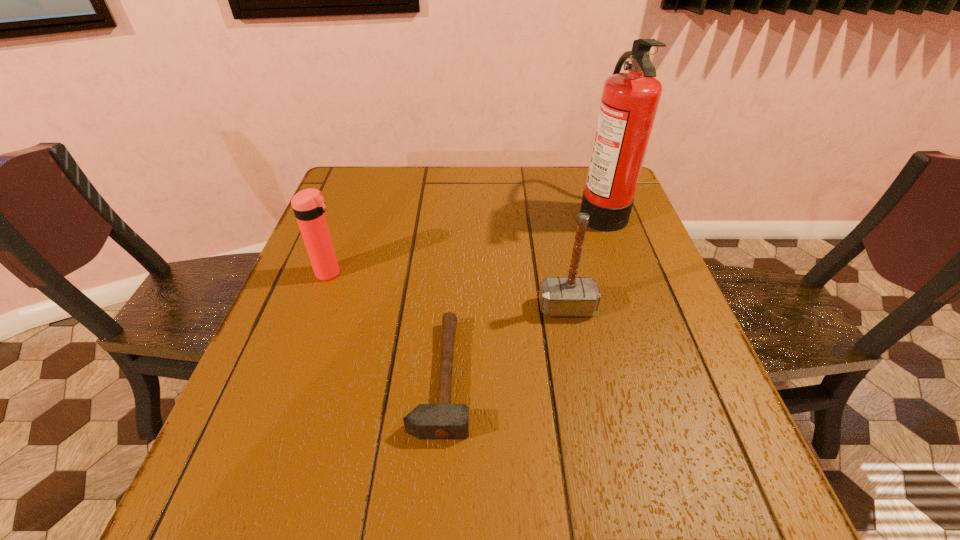
At what (x,y) coordinates should I click in order to perform the action: click on the tallest object. Please return your answer as a coordinate pair (x, y). Image resolution: width=960 pixels, height=540 pixels. Looking at the image, I should click on (629, 103).

Find the location of a particular element. The width and height of the screenshot is (960, 540). the farthest object is located at coordinates (629, 103).

The width and height of the screenshot is (960, 540). I want to click on the third object from left to right, so click(558, 296).

Locate an element on the screen. the second nearest object is located at coordinates (558, 296).

Image resolution: width=960 pixels, height=540 pixels. Find the location of `thermos bottle`. thermos bottle is located at coordinates (308, 205).

Identify the location of the leftmost object. (308, 205).

Find the location of a particular element. the second object from left to right is located at coordinates (443, 420).

This screenshot has width=960, height=540. In order to click on the nearer hammer in this screenshot , I will do `click(443, 420)`.

I want to click on vacant space located on the front-facing side of the tallest object, so click(x=511, y=211).

You are a GUI agent. You are given a task and a screenshot of the screen. Output one action in this format:
    pyautogui.click(x=<x>, y=<y>)
    Task: Click on the free space located 0.370m on the front-facing side of the tallest object
    
    Given the screenshot: What is the action you would take?
    pyautogui.click(x=447, y=211)